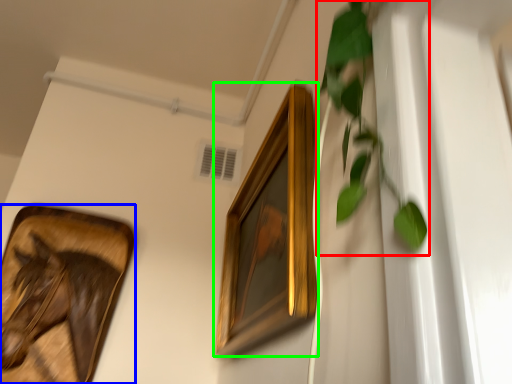
Question: Considering the real-world distances, which object is farthest from vegetation (highlighted by a red box)? picture frame (highlighted by a blue box) or picture frame (highlighted by a green box)?

Choices:
 (A) picture frame
 (B) picture frame

Answer: (A)